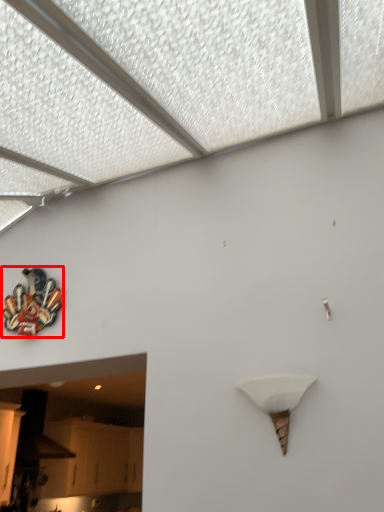
Question: From the image's perspective, what is the correct spatial positioning of art (annotated by the red box) in reference to lamp?

Choices:
 (A) below
 (B) above

Answer: (B)